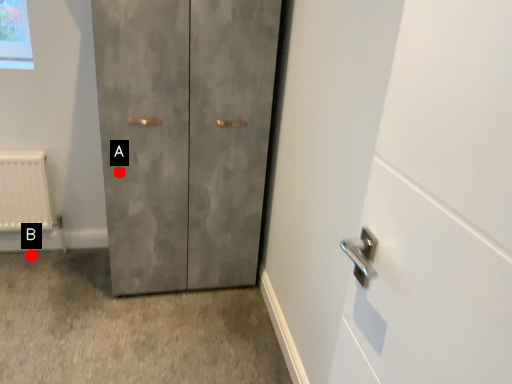
Question: Two points are circled on the image, labeled by A and B beside each circle. Among these points, which one is nearest to the camera?

Choices:
 (A) A is closer
 (B) B is closer

Answer: (A)